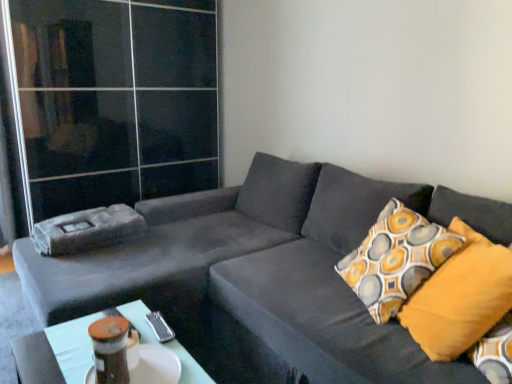
Question: Which is correct: matte plastic table at lower center is inside velvet gray couch at center, or outside of it?

Choices:
 (A) inside
 (B) outside

Answer: (A)

Question: Considering their positions, is matte plastic table at lower center located in front of or behind velvet gray couch at center?

Choices:
 (A) front
 (B) behind

Answer: (B)

Question: Estimate the real-world distances between objects in this image. Which object is farther from the velvet gray couch at center?

Choices:
 (A) mustard yellow fabric pillow at right
 (B) transparent glass door at upper left
 (C) matte plastic table at lower center

Answer: (B)

Question: Which object is positioned farthest from the matte plastic table at lower center?

Choices:
 (A) transparent glass door at upper left
 (B) mustard yellow fabric pillow at right
 (C) velvet gray couch at center

Answer: (A)